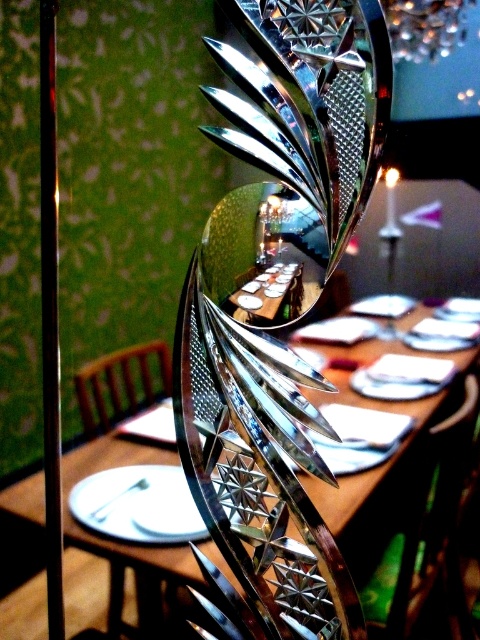
Question: Among these objects, which one is nearest to the camera?

Choices:
 (A) shiny silver tableware at center
 (B) silvermetallicfork at right
 (C) metallic textured lamp at upper right

Answer: (C)

Question: Is metallic textured lamp at upper right smaller than silvermetallicfork at right?

Choices:
 (A) yes
 (B) no

Answer: (B)

Question: Can you confirm if shiny silver tableware at center is positioned below metallic textured lamp at upper right?

Choices:
 (A) yes
 (B) no

Answer: (A)

Question: Which point is closer to the camera?

Choices:
 (A) silver metallic spoon at center
 (B) shiny silver tableware at center

Answer: (B)

Question: Which point is closer to the camera taking this photo?

Choices:
 (A) (126, 486)
 (B) (408, 378)
 (C) (269, 168)

Answer: (B)

Question: Does polished silver sculpture at center appear on the right side of silvermetallicfork at right?

Choices:
 (A) yes
 (B) no

Answer: (B)